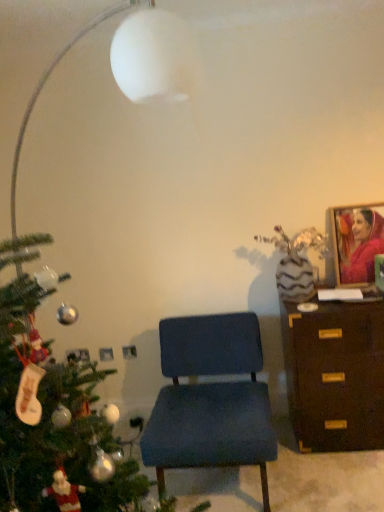
Question: Does blue fabric chair at center have a larger size compared to brown wooden chest of drawers at right?

Choices:
 (A) yes
 (B) no

Answer: (A)

Question: Would you consider blue fabric chair at center to be distant from brown wooden chest of drawers at right?

Choices:
 (A) no
 (B) yes

Answer: (A)

Question: From a real-world perspective, is blue fabric chair at center physically below brown wooden chest of drawers at right?

Choices:
 (A) no
 (B) yes

Answer: (B)

Question: From a real-world perspective, is blue fabric chair at center on top of brown wooden chest of drawers at right?

Choices:
 (A) yes
 (B) no

Answer: (B)

Question: Can you confirm if blue fabric chair at center is positioned to the right of brown wooden chest of drawers at right?

Choices:
 (A) yes
 (B) no

Answer: (B)

Question: Considering their positions, is brown wooden chest of drawers at right located in front of or behind matte pink fabric portrait at upper right?

Choices:
 (A) behind
 (B) front

Answer: (B)

Question: From the image's perspective, is brown wooden chest of drawers at right above or below matte pink fabric portrait at upper right?

Choices:
 (A) above
 (B) below

Answer: (B)

Question: Based on their sizes in the image, would you say brown wooden chest of drawers at right is bigger or smaller than matte pink fabric portrait at upper right?

Choices:
 (A) big
 (B) small

Answer: (A)

Question: Is brown wooden chest of drawers at right wider or thinner than matte pink fabric portrait at upper right?

Choices:
 (A) wide
 (B) thin

Answer: (A)

Question: Is matte pink fabric portrait at upper right in front of or behind blue fabric chair at center in the image?

Choices:
 (A) behind
 (B) front

Answer: (A)

Question: From a real-world perspective, is matte pink fabric portrait at upper right physically located above or below blue fabric chair at center?

Choices:
 (A) above
 (B) below

Answer: (A)

Question: Is matte pink fabric portrait at upper right wider or thinner than blue fabric chair at center?

Choices:
 (A) thin
 (B) wide

Answer: (A)

Question: Considering the relative positions of matte pink fabric portrait at upper right and blue fabric chair at center in the image provided, is matte pink fabric portrait at upper right to the left or to the right of blue fabric chair at center?

Choices:
 (A) right
 (B) left

Answer: (A)

Question: Would you say blue fabric chair at center is to the left or to the right of brown wooden chest of drawers at right in the picture?

Choices:
 (A) right
 (B) left

Answer: (B)

Question: Considering the positions of blue fabric chair at center and brown wooden chest of drawers at right in the image, is blue fabric chair at center taller or shorter than brown wooden chest of drawers at right?

Choices:
 (A) short
 (B) tall

Answer: (A)